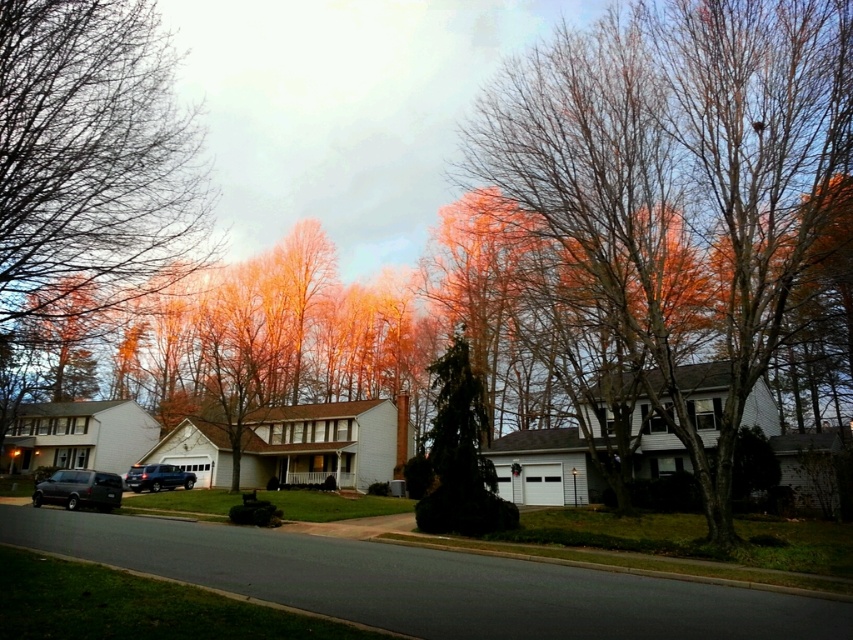
Who is more forward, [662,35] or [450,529]?

Point [662,35]

Can you confirm if bare branches at center is bigger than green textured evergreen tree at center?

Indeed, bare branches at center has a larger size compared to green textured evergreen tree at center.

Locate an element on the screen. bare branches at center is located at coordinates (683, 180).

Is matte black van at lower left to the left of satin black suv at center from the viewer's perspective?

Yes, matte black van at lower left is to the left of satin black suv at center.

From the picture: Which of these two, matte black van at lower left or satin black suv at center, stands shorter?

With less height is satin black suv at center.

In order to click on matte black van at lower left in this screenshot , I will do pyautogui.click(x=79, y=490).

Where is `matte black van at lower left`? matte black van at lower left is located at coordinates (79, 490).

Based on the photo, is bare branches at center positioned in front of satin black suv at center?

Yes, it is in front of satin black suv at center.

Between bare branches at center and satin black suv at center, which one is positioned lower?

→ satin black suv at center

Who is more distant from viewer, (712, 476) or (142, 481)?

The point (142, 481) is more distant.

Where is `bare branches at center`? bare branches at center is located at coordinates (683, 180).